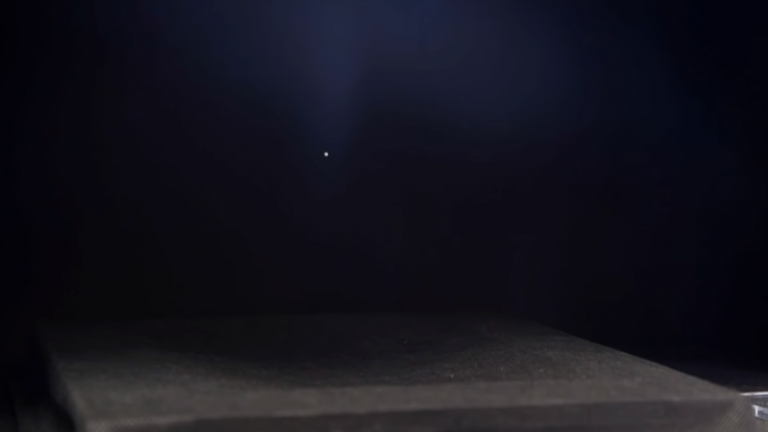
You are a GUI agent. You are given a task and a screenshot of the screen. Output one action in this format:
    pyautogui.click(x=<x>, y=<y>)
    Task: Click on the white spots on rug
    The height and width of the screenshot is (432, 768).
    Given the screenshot: What is the action you would take?
    pyautogui.click(x=454, y=375), pyautogui.click(x=382, y=389), pyautogui.click(x=257, y=375)